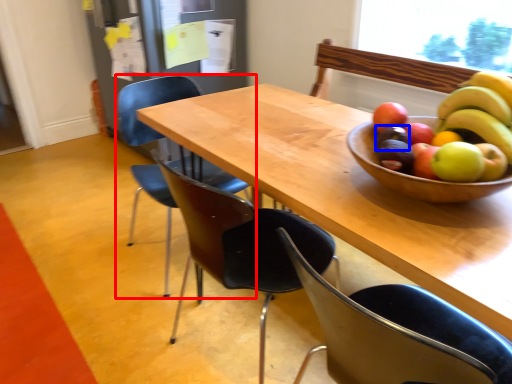
Question: Among these objects, which one is nearest to the camera, chair (highlighted by a red box) or avocado (highlighted by a blue box)?

Choices:
 (A) chair
 (B) avocado

Answer: (B)